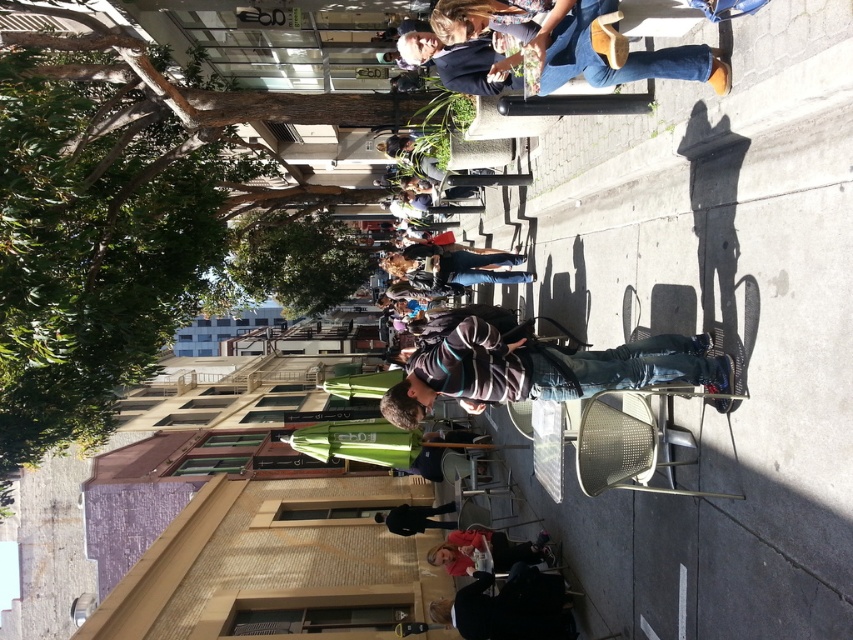
Who is more distant from viewer, (558, 29) or (469, 593)?

The point (469, 593) is more distant.

At what (x,y) coordinates should I click in order to perform the action: click on denim jeans at upper center. Please return your answer as a coordinate pair (x, y). Image resolution: width=853 pixels, height=640 pixels. Looking at the image, I should click on (611, 52).

Between point (517, 13) and point (473, 580), which one is positioned in front?

Point (517, 13)

What are the coordinates of `denim jeans at upper center` in the screenshot? It's located at (611, 52).

From the picture: Between dark gray fabric jacket at lower center and black fabric jacket at lower center, which one appears on the right side from the viewer's perspective?

dark gray fabric jacket at lower center is more to the right.

Between point (566, 596) and point (433, 522), which one is positioned in front?

Positioned in front is point (566, 596).

Does point (550, 611) come in front of point (408, 529)?

Yes, point (550, 611) is in front of point (408, 529).

This screenshot has height=640, width=853. I want to click on dark gray fabric jacket at lower center, so click(x=509, y=608).

Does denim jeans at upper center appear over black fabric jacket at lower center?

Yes.

Identify the location of denim jeans at upper center. Image resolution: width=853 pixels, height=640 pixels. (611, 52).